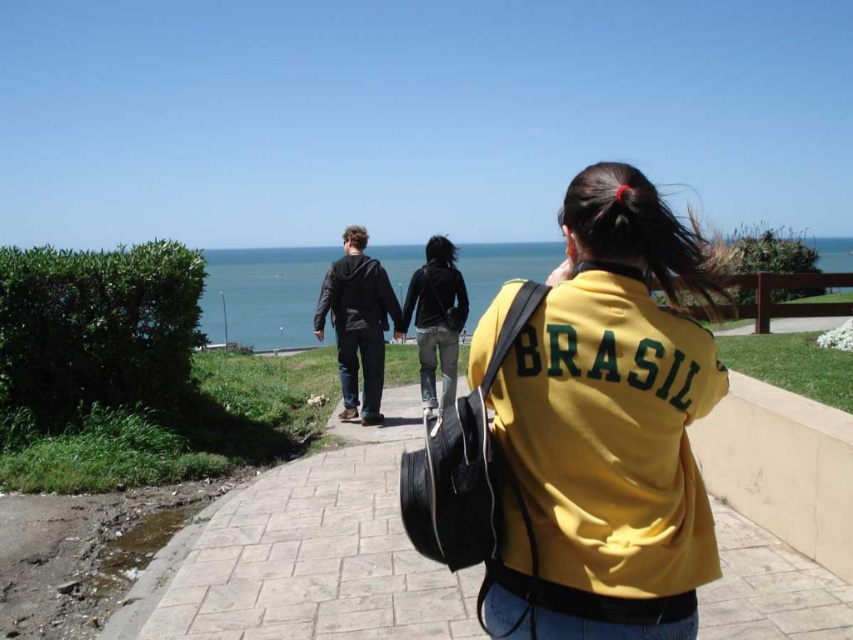
You are a photographer positioned at the start of the paved stone pavement at center. You want to capture a wide shot of the dark gray hoodie at center without any obstructions. Is the pavement wide enough to allow you to position yourself and the subject comfortably?

The paved stone pavement at center is wider than the dark gray hoodie at center, so yes, the photographer can position themselves and the subject comfortably on the pavement without obstructions.

You are standing at the beginning of the paved stone pavement at center and want to see the dark gray hoodie at center. Can you see it without any obstruction?

The paved stone pavement at center has a lesser height compared to dark gray hoodie at center, so yes, the dark gray hoodie at center is visible above the paved stone pavement at center.